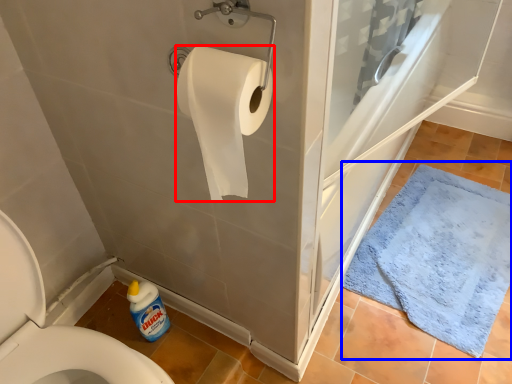
Question: Which point is further to the camera, toilet paper (highlighted by a red box) or bath mat (highlighted by a blue box)?

Choices:
 (A) toilet paper
 (B) bath mat

Answer: (B)